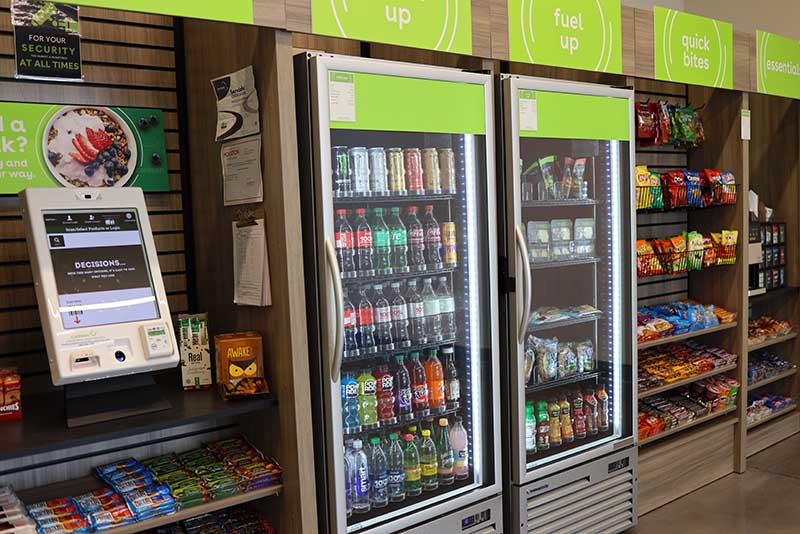
I want to click on bottom vents on the fridge, so click(592, 499), click(484, 528).